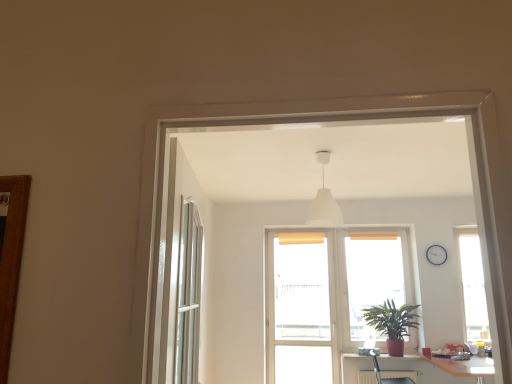
Question: From the image's perspective, is white glossy table at lower right located above or below metallic silver armchair at lower right?

Choices:
 (A) below
 (B) above

Answer: (A)

Question: Considering the positions of point (493, 360) and point (389, 377), is point (493, 360) closer or farther from the camera than point (389, 377)?

Choices:
 (A) farther
 (B) closer

Answer: (B)

Question: Which object is the closest to the translucent fabric screen at center?

Choices:
 (A) metallic silver armchair at lower right
 (B) translucent plastic screen door at center
 (C) white plastic clock at upper right
 (D) white matte lampshade at center
 (E) white glossy table at lower right

Answer: (B)

Question: Considering the real-world distances, which object is closest to the white glossy table at lower right?

Choices:
 (A) white plastic clock at upper right
 (B) translucent fabric screen at center
 (C) translucent plastic screen door at center
 (D) green matte plant at lower right
 (E) white matte lampshade at center

Answer: (D)